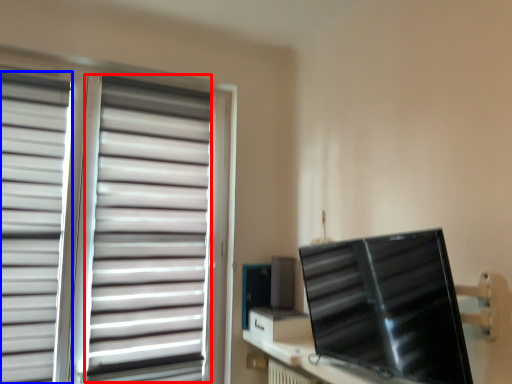
Question: Which of the following is the farthest to the observer, curtain (highlighted by a red box) or curtain (highlighted by a blue box)?

Choices:
 (A) curtain
 (B) curtain

Answer: (A)